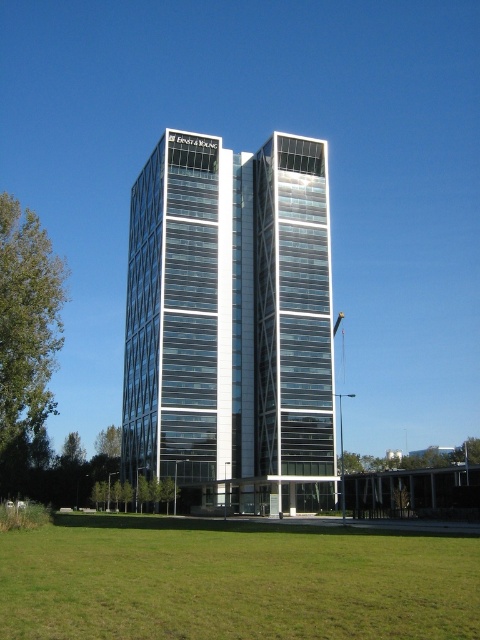
Question: Which point is farther from the camera taking this photo?

Choices:
 (A) (178, 198)
 (B) (75, 618)

Answer: (A)

Question: Which point appears farthest from the camera in this image?

Choices:
 (A) (36, 600)
 (B) (152, 256)

Answer: (B)

Question: Is transparent glass building at center bigger than green grass at lower center?

Choices:
 (A) yes
 (B) no

Answer: (A)

Question: Can you confirm if transparent glass building at center is positioned below green grass at lower center?

Choices:
 (A) yes
 (B) no

Answer: (B)

Question: Is transparent glass building at center behind green grass at lower center?

Choices:
 (A) no
 (B) yes

Answer: (B)

Question: Which point appears closest to the camera in this image?

Choices:
 (A) (60, 536)
 (B) (216, 467)

Answer: (A)